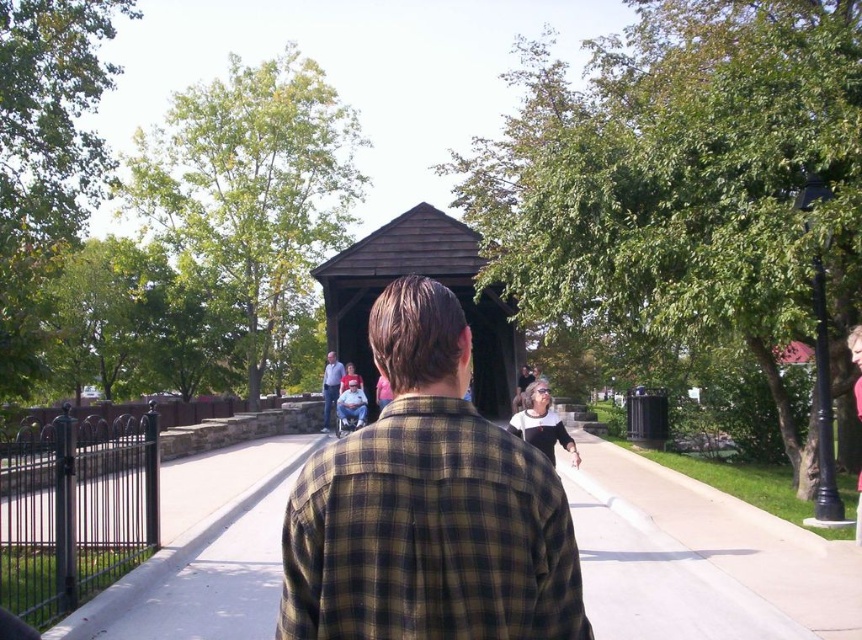
You are a photographer trying to capture a group photo of the plaid shirt at center and the light blue shirt at center. Which of the two should you position closer to the camera to ensure both appear the same size in the photo?

Since the plaid shirt at center is wider than the light blue shirt at center, you should position the plaid shirt at center farther away from the camera and the light blue shirt at center closer. This way, their apparent sizes in the photo will balance out.

You are standing at point (323, 372) and want to walk to the covered structure in the midground. There is an obstacle at point (417, 272). Will you pass in front of or behind the obstacle when moving towards your destination?

You will pass behind the obstacle at point (417, 272) because the point (417, 272) is behind point (323, 372) according to the spatial description.

You are standing at the point marked by the coordinates point (428, 506). Looking around, you see a person in a plaid shirt at center and a dark wood pavilion in the midground. Which direction should you walk to reach the dark wood pavilion?

The plaid shirt at center is located at point (428, 506). Since the dark wood pavilion is in the midground along the pathway, you should walk forward towards the pavilion.